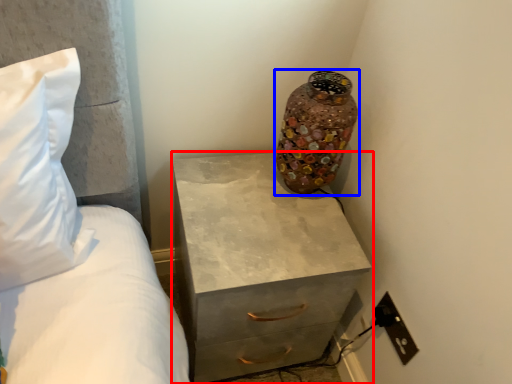
Question: Among these objects, which one is nearest to the camera, chest of drawers (highlighted by a red box) or vase (highlighted by a blue box)?

Choices:
 (A) chest of drawers
 (B) vase

Answer: (A)